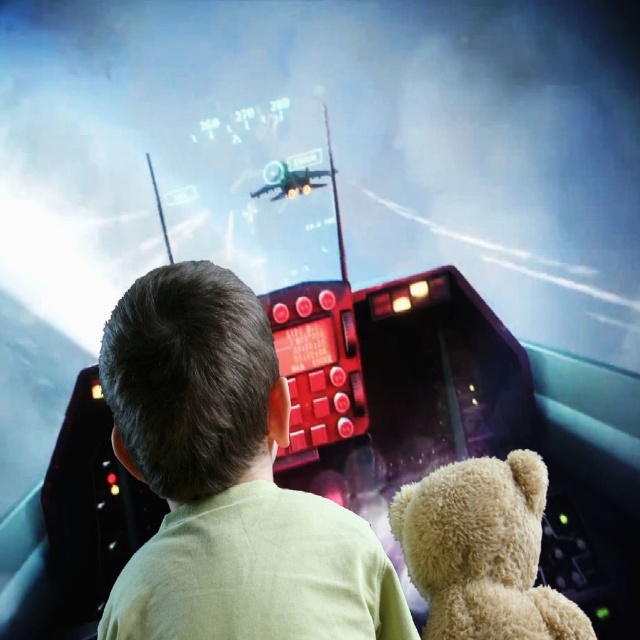
Question: Among these objects, which one is nearest to the camera?

Choices:
 (A) shiny black helmet at center
 (B) fuzzy beige teddy bear at center
 (C) shiny black plane at center

Answer: (A)

Question: Can you confirm if shiny black helmet at center is positioned to the right of shiny black plane at center?

Choices:
 (A) no
 (B) yes

Answer: (B)

Question: Does fuzzy beige teddy bear at center lie in front of shiny black plane at center?

Choices:
 (A) yes
 (B) no

Answer: (A)

Question: Does shiny black helmet at center have a smaller size compared to fuzzy beige teddy bear at center?

Choices:
 (A) yes
 (B) no

Answer: (B)

Question: Which object is the closest to the shiny black plane at center?

Choices:
 (A) fuzzy beige teddy bear at center
 (B) shiny black helmet at center

Answer: (A)

Question: Based on their relative distances, which object is nearer to the fuzzy beige teddy bear at center?

Choices:
 (A) shiny black plane at center
 (B) shiny black helmet at center

Answer: (B)